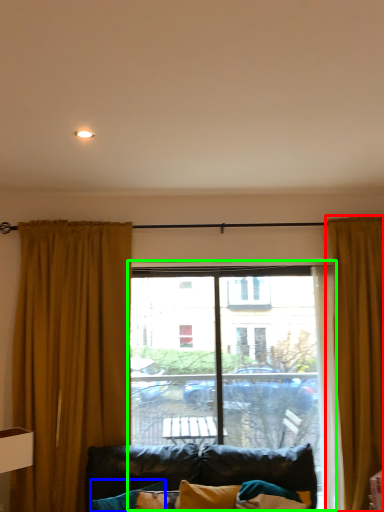
Question: Which object is positioned closest to curtain (highlighted by a red box)? Select from pillow (highlighted by a blue box) and window (highlighted by a green box).

Choices:
 (A) pillow
 (B) window

Answer: (B)